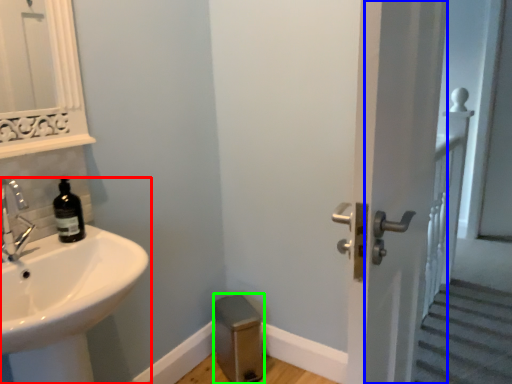
Question: Which is farther away from sink (highlighted by a red box)? screen door (highlighted by a blue box) or step stool (highlighted by a green box)?

Choices:
 (A) screen door
 (B) step stool

Answer: (B)